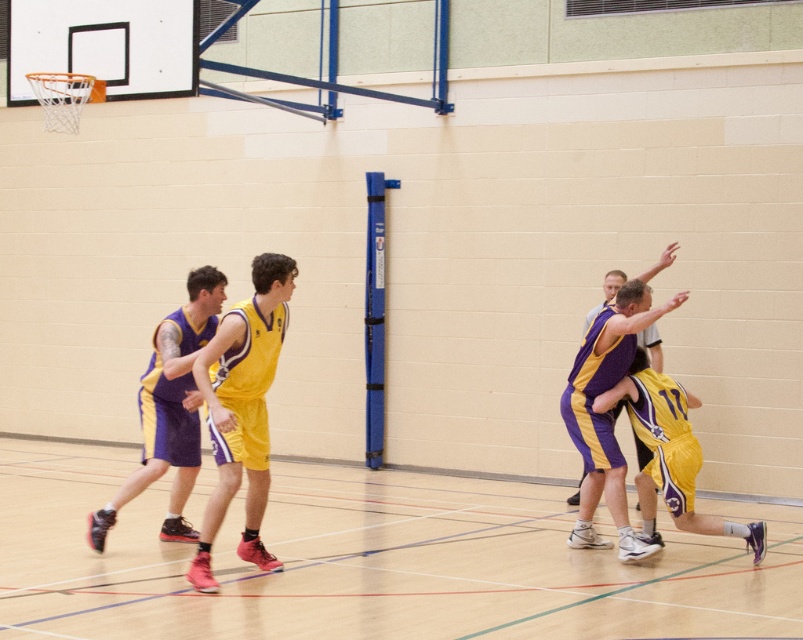
Looking at this image, in the basketball game scene, there is a point marked at coordinates (169, 408). Which player is located at this point? Choose between the player in the yellow jersey with purple accents and the player in the purple jersey with yellow accents.

The point at (169, 408) indicates the purple jersey with yellow accents player at the left.